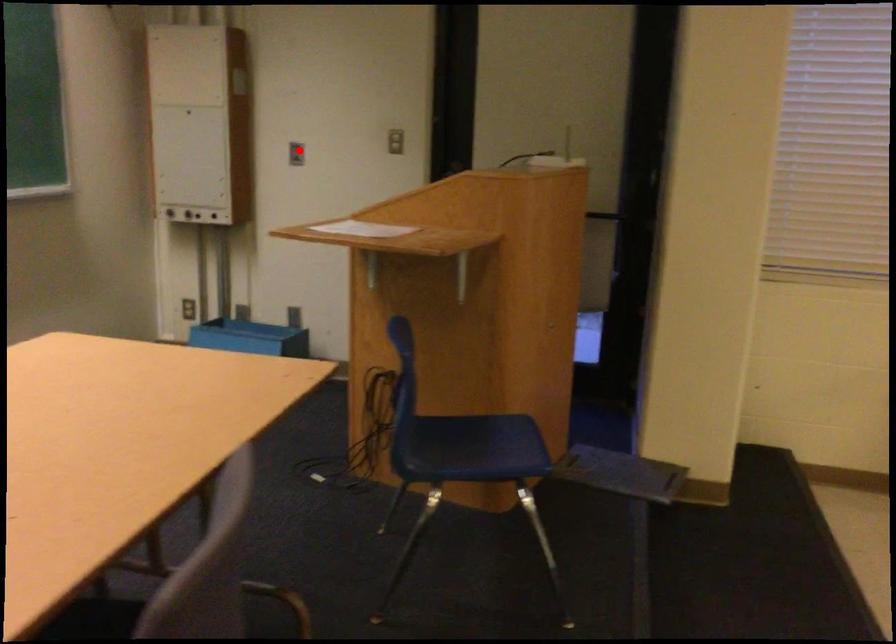
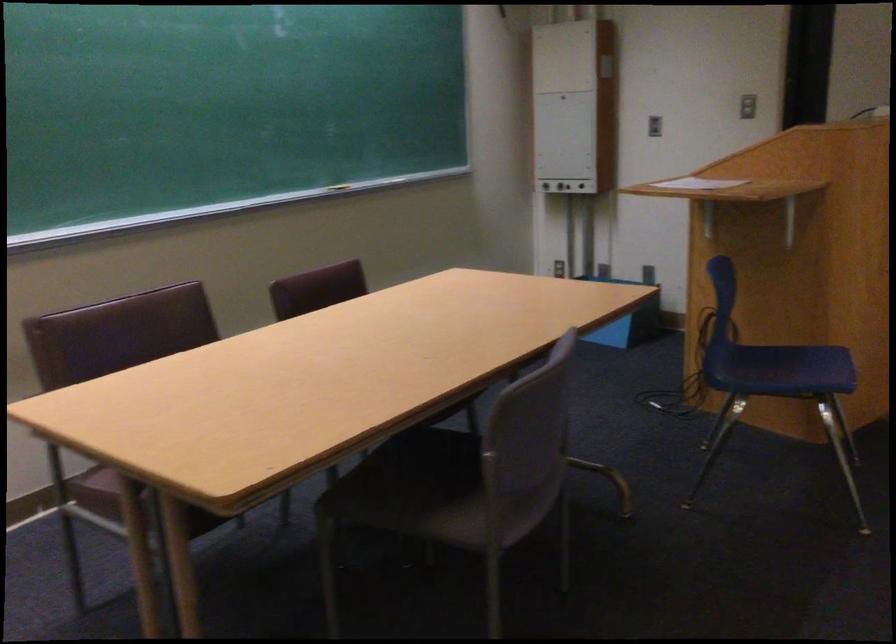
Question: I am providing you with two images of the same scene from different viewpoints. Image1 has a red point marked. In image2, the corresponding 3D location appears at what relative position? Reply with the corresponding letter.

Choices:
 (A) Closer
 (B) Farther

Answer: (B)